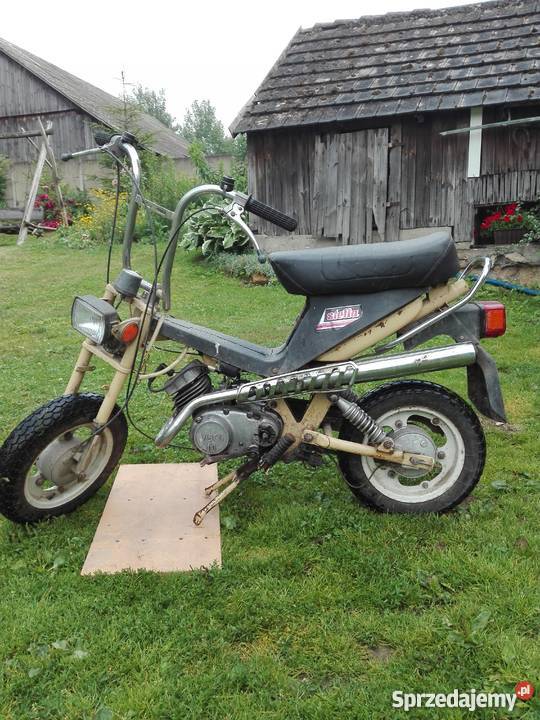
Find the location of a particular element. The width and height of the screenshot is (540, 720). stand is located at coordinates (230, 486).